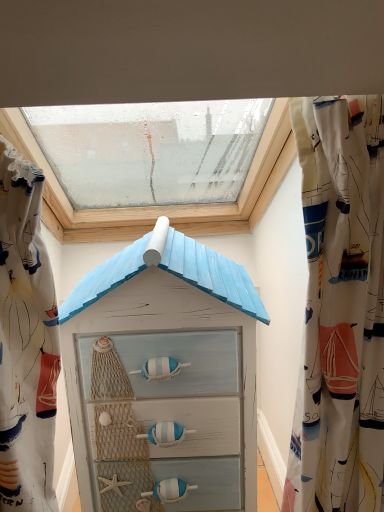
Question: Can you see light blue painted wood at center touching white sailboat-patterned fabric at upper left, the 2th curtain when ordered from right to left?

Choices:
 (A) yes
 (B) no

Answer: (B)

Question: Does light blue painted wood at center have a greater height compared to white sailboat-patterned fabric at upper left, the 2th curtain when ordered from right to left?

Choices:
 (A) yes
 (B) no

Answer: (A)

Question: Would you say light blue painted wood at center contains white sailboat-patterned fabric at upper left, the 2th curtain when ordered from right to left?

Choices:
 (A) yes
 (B) no

Answer: (B)

Question: Is light blue painted wood at center aimed at white sailboat-patterned fabric at upper left, the 2th curtain when ordered from right to left?

Choices:
 (A) yes
 (B) no

Answer: (A)

Question: Considering the relative positions of light blue painted wood at center and white sailboat-patterned fabric at upper left, the 2th curtain when ordered from right to left, in the image provided, is light blue painted wood at center in front of white sailboat-patterned fabric at upper left, the 2th curtain when ordered from right to left,?

Choices:
 (A) yes
 (B) no

Answer: (B)

Question: From their relative heights in the image, would you say transparent glass window at upper center is taller or shorter than light blue painted wood at center?

Choices:
 (A) short
 (B) tall

Answer: (A)

Question: Relative to light blue painted wood at center, is transparent glass window at upper center in front or behind?

Choices:
 (A) front
 (B) behind

Answer: (B)

Question: Which is correct: transparent glass window at upper center is inside light blue painted wood at center, or outside of it?

Choices:
 (A) inside
 (B) outside

Answer: (B)

Question: In terms of size, does transparent glass window at upper center appear bigger or smaller than light blue painted wood at center?

Choices:
 (A) small
 (B) big

Answer: (B)

Question: Based on their positions, is white fabric with nautical prints at right, the second curtain positioned from the left, located to the left or right of transparent glass window at upper center?

Choices:
 (A) right
 (B) left

Answer: (A)

Question: From the image's perspective, is white fabric with nautical prints at right, placed as the first curtain when sorted from right to left, above or below transparent glass window at upper center?

Choices:
 (A) below
 (B) above

Answer: (A)

Question: From a real-world perspective, is white fabric with nautical prints at right, placed as the first curtain when sorted from right to left, physically located above or below transparent glass window at upper center?

Choices:
 (A) below
 (B) above

Answer: (A)

Question: Considering the positions of point [x=339, y=199] and point [x=271, y=118], is point [x=339, y=199] closer or farther from the camera than point [x=271, y=118]?

Choices:
 (A) closer
 (B) farther

Answer: (A)

Question: From a real-world perspective, is white sailboat-patterned fabric at upper left, the 2th curtain when ordered from right to left, physically located above or below white fabric with nautical prints at right, the second curtain positioned from the left?

Choices:
 (A) above
 (B) below

Answer: (A)

Question: Is white sailboat-patterned fabric at upper left, the 2th curtain when ordered from right to left, in front of or behind white fabric with nautical prints at right, placed as the first curtain when sorted from right to left, in the image?

Choices:
 (A) behind
 (B) front

Answer: (B)